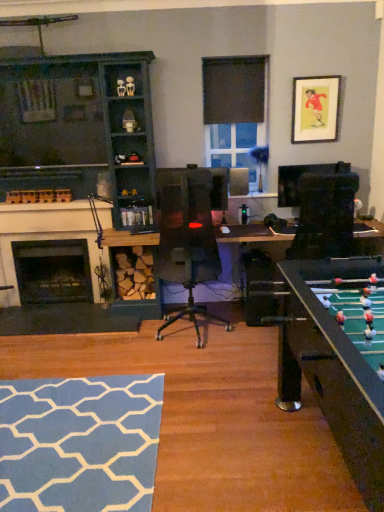
What are the coordinates of `vacant space in front of white painted wood fireplace at left, the 1th fireplace in the front-to-back sequence` in the screenshot? It's located at (56, 348).